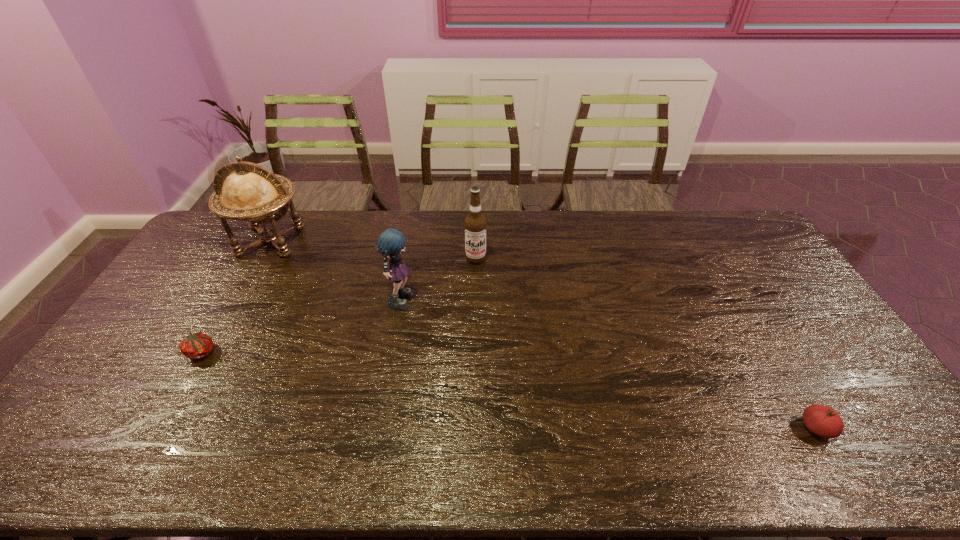
Locate an element on the screen. The height and width of the screenshot is (540, 960). vacant space that satisfies the following two spatial constraints: 1. on the front-facing side of the globe; 2. on the right side of the taller tomato is located at coordinates (166, 428).